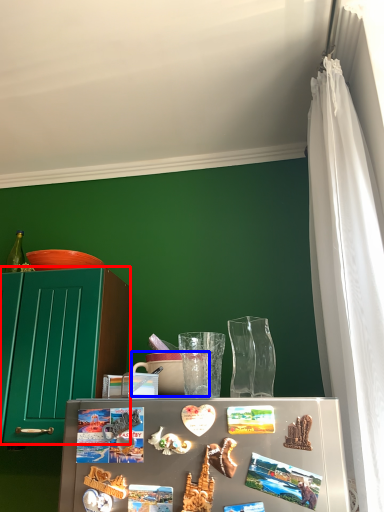
Question: Which point is closer to the camera, cabinetry (highlighted by a red box) or coffee cup (highlighted by a blue box)?

Choices:
 (A) cabinetry
 (B) coffee cup

Answer: (B)